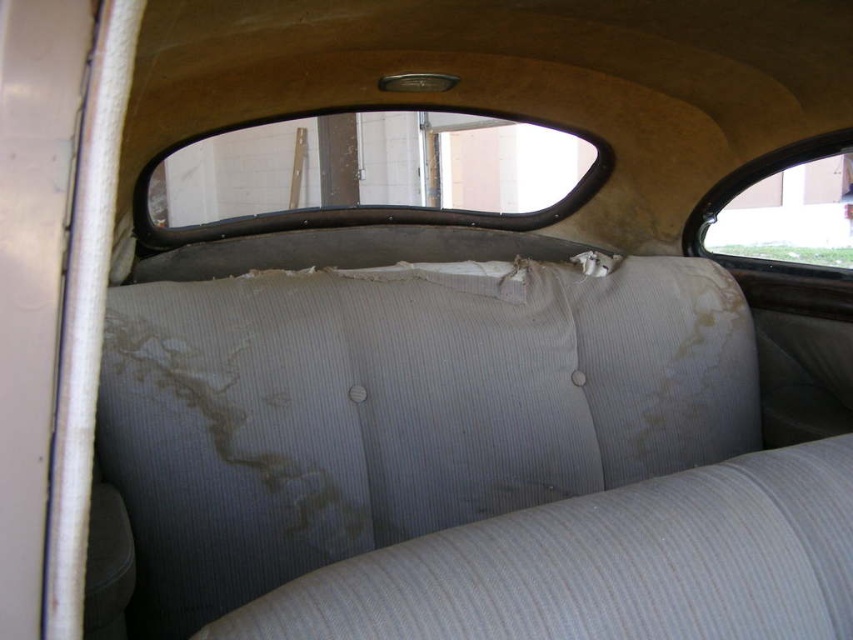
You are a passenger sitting in the back seat of the old vehicle. You want to look outside through the clear glass window at upper center. According to the coordinates provided, where should you look? Please provide the coordinates in the format of a point like point (x=373, y=173).

The point (x=373, y=173) marks the clear glass window at upper center, so you should look at point (x=373, y=173) to see outside through the clear glass window at upper center.

You are a passenger sitting in the back seat of the old vehicle. You want to look outside through the windows. Which clear glass window is higher up, the clear glass window at upper center or the clear glass window at upper right?

The clear glass window at upper center is located above the clear glass window at upper right, so it is higher up.

You are a delivery person standing at the back seat of the old vehicle. You need to hand over a package to a passenger sitting in the front seat. The package is too large to pass through the gap between the seats. Can you throw the package through the clear glass window at upper center? Explain your reasoning.

The clear glass window at upper center is 4.81 meters from camera. Since the window is located 4.81 meters away from your position at the back seat, throwing the package that distance would be impractical and likely impossible due to the distance and the confined space of the vehicle. Additionally, throwing might damage the window or the package.